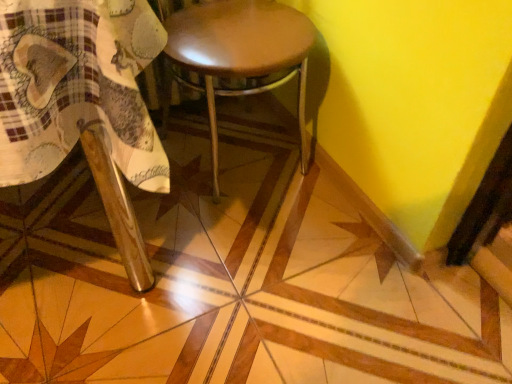
Where is `free point below shiny brown stool at center (from a real-world perspective)`? The height and width of the screenshot is (384, 512). free point below shiny brown stool at center (from a real-world perspective) is located at coordinates (234, 159).